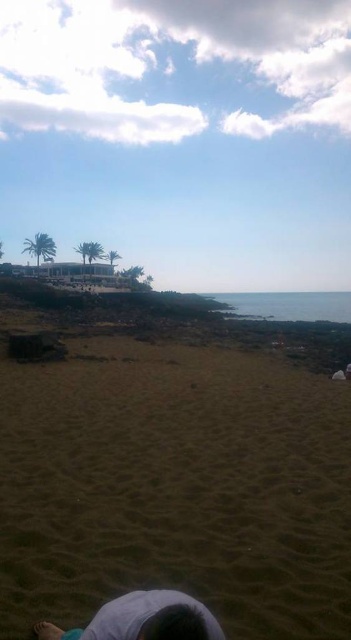
Is brown sandy beach at lower center thinner than light blue fabric at lower center?

No, brown sandy beach at lower center is not thinner than light blue fabric at lower center.

Which is below, brown sandy beach at lower center or light blue fabric at lower center?

brown sandy beach at lower center

Between point (74, 452) and point (191, 632), which one is positioned behind?

Positioned behind is point (74, 452).

Identify the location of brown sandy beach at lower center. (175, 484).